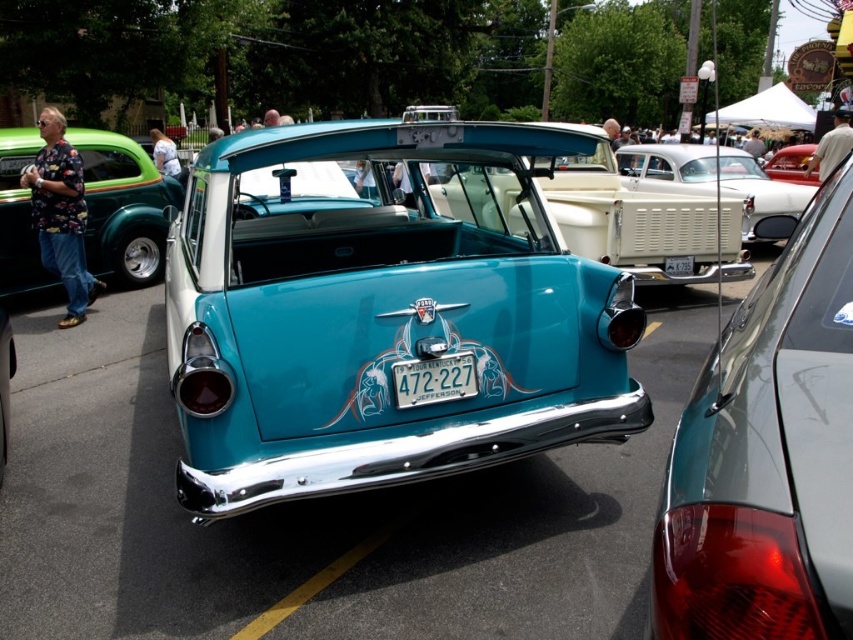
Question: Which object is the closest to the blue metallic license plate at center?

Choices:
 (A) shiny green car at left
 (B) glossy teal car at center
 (C) glossy metallic car at right

Answer: (B)

Question: Which point is farther from the camera taking this photo?

Choices:
 (A) (421, 364)
 (B) (352, 461)
 (C) (752, 182)
 (D) (840, 168)

Answer: (C)

Question: Among these points, which one is nearest to the camera?

Choices:
 (A) (410, 189)
 (B) (422, 394)

Answer: (B)

Question: Is glossy teal car at center bigger than shiny green car at left?

Choices:
 (A) yes
 (B) no

Answer: (A)

Question: Does glossy teal car at center appear on the left side of white glossy pickup truck at center?

Choices:
 (A) yes
 (B) no

Answer: (A)

Question: Can you confirm if glossy metallic car at right is wider than white glossy pickup truck at center?

Choices:
 (A) no
 (B) yes

Answer: (A)